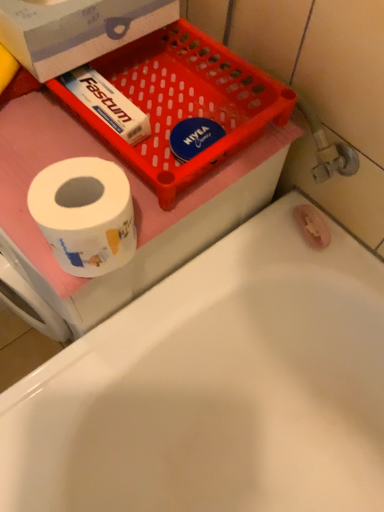
Question: Is white cardboard box at upper left surrounding white glossy bathtub at lower left?

Choices:
 (A) no
 (B) yes

Answer: (A)

Question: Considering the relative positions of white cardboard box at upper left and white glossy bathtub at lower left in the image provided, is white cardboard box at upper left in front of white glossy bathtub at lower left?

Choices:
 (A) yes
 (B) no

Answer: (B)

Question: From the image's perspective, is white cardboard box at upper left below white glossy bathtub at lower left?

Choices:
 (A) no
 (B) yes

Answer: (A)

Question: Is white cardboard box at upper left to the right of white glossy bathtub at lower left from the viewer's perspective?

Choices:
 (A) yes
 (B) no

Answer: (B)

Question: Does white cardboard box at upper left have a lesser width compared to white glossy bathtub at lower left?

Choices:
 (A) no
 (B) yes

Answer: (B)

Question: Is white cardboard box at upper left positioned beyond the bounds of white glossy bathtub at lower left?

Choices:
 (A) no
 (B) yes

Answer: (B)

Question: Can white glossy toilet paper at left be found inside white glossy bathtub at lower left?

Choices:
 (A) no
 (B) yes

Answer: (A)

Question: Is white glossy bathtub at lower left further to the viewer compared to white glossy toilet paper at left?

Choices:
 (A) no
 (B) yes

Answer: (A)

Question: Does white glossy bathtub at lower left have a larger size compared to white glossy toilet paper at left?

Choices:
 (A) no
 (B) yes

Answer: (B)

Question: Does white glossy bathtub at lower left touch white glossy toilet paper at left?

Choices:
 (A) yes
 (B) no

Answer: (B)

Question: Is white glossy bathtub at lower left not close to white glossy toilet paper at left?

Choices:
 (A) yes
 (B) no

Answer: (B)

Question: From a real-world perspective, is white glossy bathtub at lower left over white glossy toilet paper at left?

Choices:
 (A) yes
 (B) no

Answer: (B)

Question: Can you confirm if white glossy toilet paper at left is positioned to the left of white glossy bathtub at lower left?

Choices:
 (A) yes
 (B) no

Answer: (A)